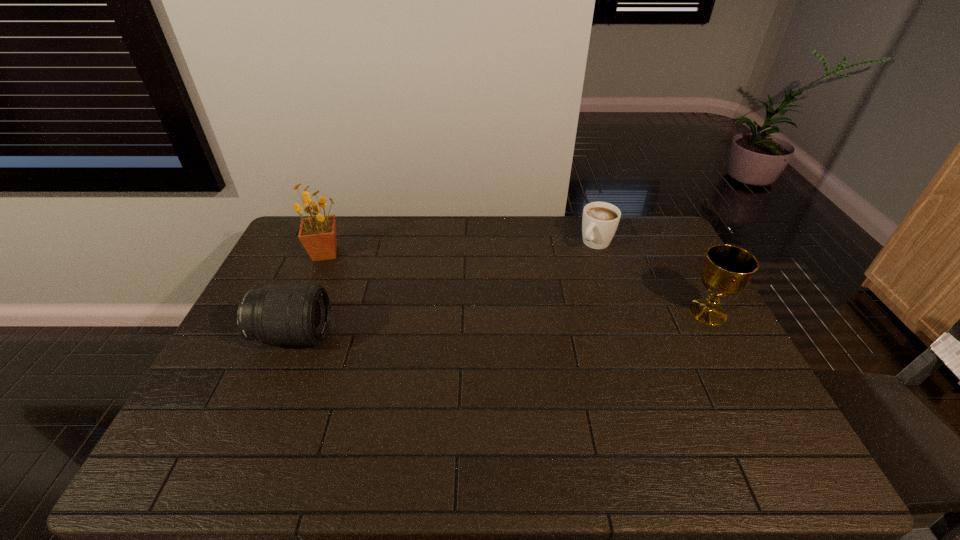
This screenshot has width=960, height=540. In order to click on vacant space at the far edge of the desktop in this screenshot , I will do `click(428, 227)`.

In the image, there is a desktop. At what (x,y) coordinates should I click in order to perform the action: click on free region at the near edge. Please return your answer as a coordinate pair (x, y). This screenshot has width=960, height=540. Looking at the image, I should click on (543, 395).

Where is `vacant space at the right edge`? Image resolution: width=960 pixels, height=540 pixels. vacant space at the right edge is located at coordinates (644, 260).

In the image, there is a desktop. Identify the location of vacant space at the far right corner. The height and width of the screenshot is (540, 960). [624, 225].

Locate an element on the screen. free region at the near right corner is located at coordinates [746, 403].

Find the location of `vacant region between the chalice and the sunflower`. vacant region between the chalice and the sunflower is located at coordinates (516, 282).

Locate an element on the screen. The height and width of the screenshot is (540, 960). free spot between the third shortest object and the telephoto lens is located at coordinates (500, 323).

Where is `vacant region between the cappuccino and the third tallest object`? This screenshot has height=540, width=960. vacant region between the cappuccino and the third tallest object is located at coordinates (444, 289).

This screenshot has height=540, width=960. What are the coordinates of `vacant area that lies between the third shortest object and the second object from right to left` in the screenshot? It's located at (652, 278).

Find the location of a particular element. This screenshot has height=540, width=960. vacant area that lies between the shortest object and the tallest object is located at coordinates (461, 248).